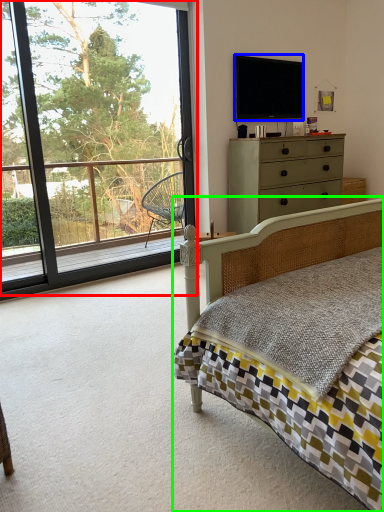
Question: Which is farther away from window (highlighted by a red box)? television (highlighted by a blue box) or bed (highlighted by a green box)?

Choices:
 (A) television
 (B) bed

Answer: (B)